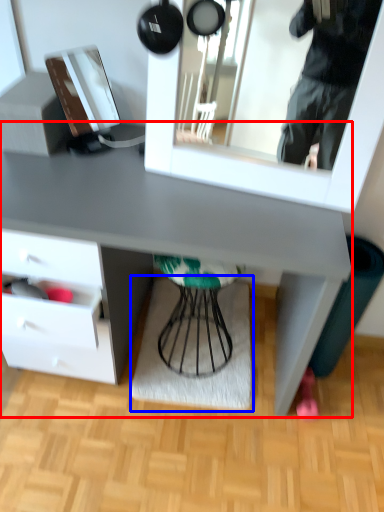
Question: Which of the following is the closest to the observer, desk (highlighted by a red box) or mat (highlighted by a blue box)?

Choices:
 (A) desk
 (B) mat

Answer: (A)